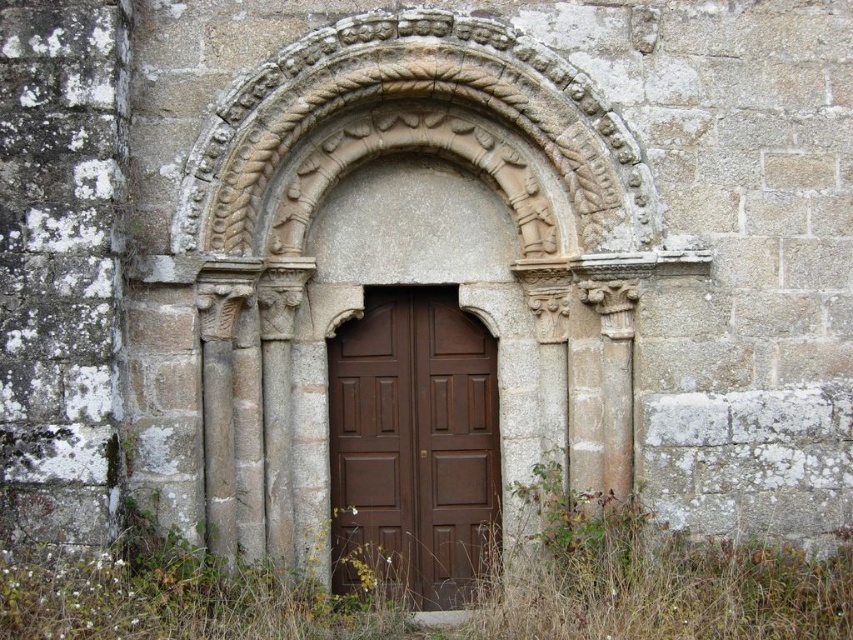
Question: Is green grass at lower center to the right of brown wooden door at center from the viewer's perspective?

Choices:
 (A) no
 (B) yes

Answer: (B)

Question: Which point is closer to the camera taking this photo?

Choices:
 (A) (364, 381)
 (B) (137, 522)

Answer: (B)

Question: Which point appears closest to the camera in this image?

Choices:
 (A) (718, 564)
 (B) (368, 304)

Answer: (A)

Question: From the image, what is the correct spatial relationship of green grass at lower center in relation to brown wooden door at center?

Choices:
 (A) above
 (B) below

Answer: (B)

Question: Is green grass at lower center thinner than brown wooden door at center?

Choices:
 (A) no
 (B) yes

Answer: (A)

Question: Which point is closer to the camera?

Choices:
 (A) brown wooden door at center
 (B) green grass at lower center

Answer: (B)